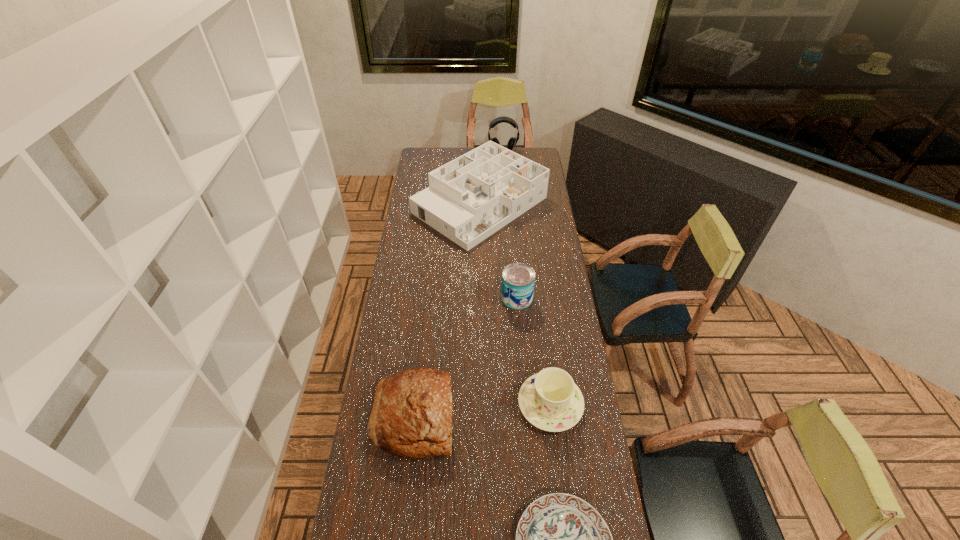
Locate an element on the screen. the tallest object is located at coordinates (512, 142).

The height and width of the screenshot is (540, 960). I want to click on earphone, so click(x=512, y=142).

Identify the location of dollhouse. click(x=468, y=199).

Identify the location of bread. This screenshot has width=960, height=540. (411, 417).

Find the location of `can`. can is located at coordinates (518, 279).

Where is `chinaware`? chinaware is located at coordinates (550, 400).

Find the location of a particular element. free space located on the ear cups of the tallest object is located at coordinates (505, 186).

Find the location of a particular element. vacant space positioned on the front of the dollhouse is located at coordinates (480, 279).

Where is `free spot located 0.100m at the sliced front of the bread`? The image size is (960, 540). free spot located 0.100m at the sliced front of the bread is located at coordinates (484, 415).

I want to click on vacant space located 0.050m on the right of the can, so click(x=544, y=298).